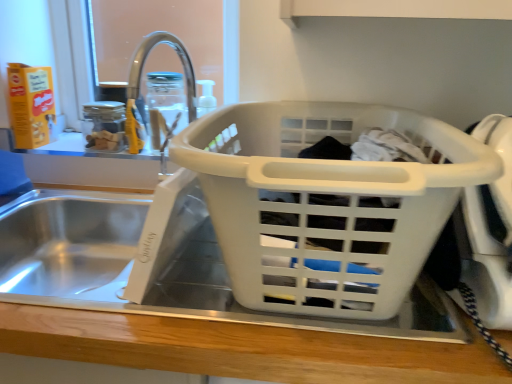
Question: Looking at their shapes, would you say white plastic laundry basket at center is wider or thinner than transparent glass jar at upper center?

Choices:
 (A) thin
 (B) wide

Answer: (B)

Question: Is white plastic laundry basket at center situated inside transparent glass jar at upper center or outside?

Choices:
 (A) inside
 (B) outside

Answer: (B)

Question: Is white plastic laundry basket at center to the left or to the right of transparent glass jar at upper center in the image?

Choices:
 (A) left
 (B) right

Answer: (B)

Question: From the image's perspective, is transparent glass jar at upper center positioned above or below white plastic laundry basket at center?

Choices:
 (A) below
 (B) above

Answer: (B)

Question: Is point (169, 99) positioned closer to the camera than point (246, 175)?

Choices:
 (A) closer
 (B) farther

Answer: (B)

Question: Considering the positions of transparent glass jar at upper center and white plastic laundry basket at center in the image, is transparent glass jar at upper center taller or shorter than white plastic laundry basket at center?

Choices:
 (A) short
 (B) tall

Answer: (A)

Question: From a real-world perspective, is transparent glass jar at upper center physically located above or below white plastic laundry basket at center?

Choices:
 (A) above
 (B) below

Answer: (A)